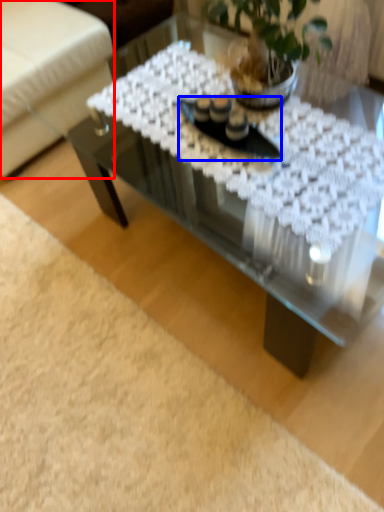
Question: Which point is closer to the camera, armchair (highlighted by a red box) or glass plate (highlighted by a blue box)?

Choices:
 (A) armchair
 (B) glass plate

Answer: (B)